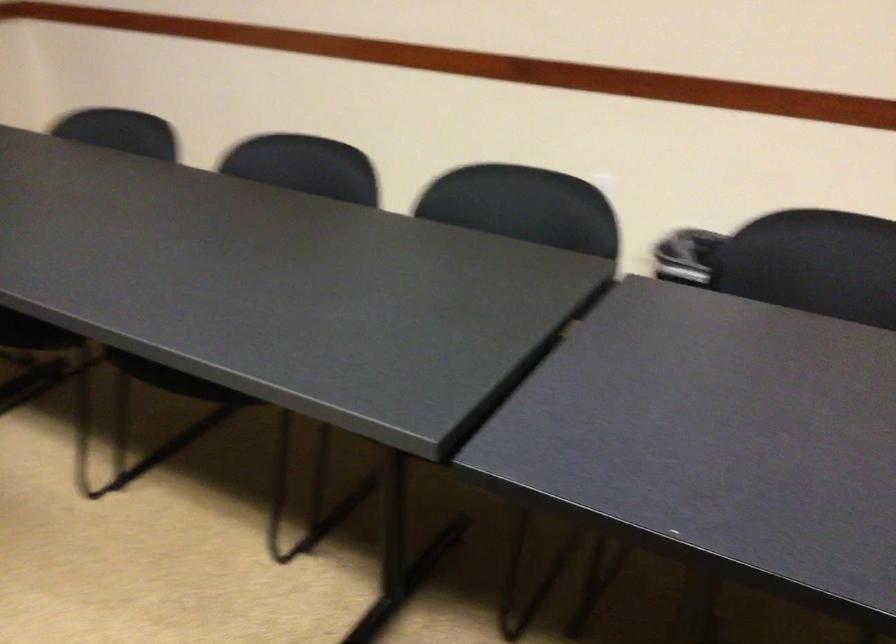
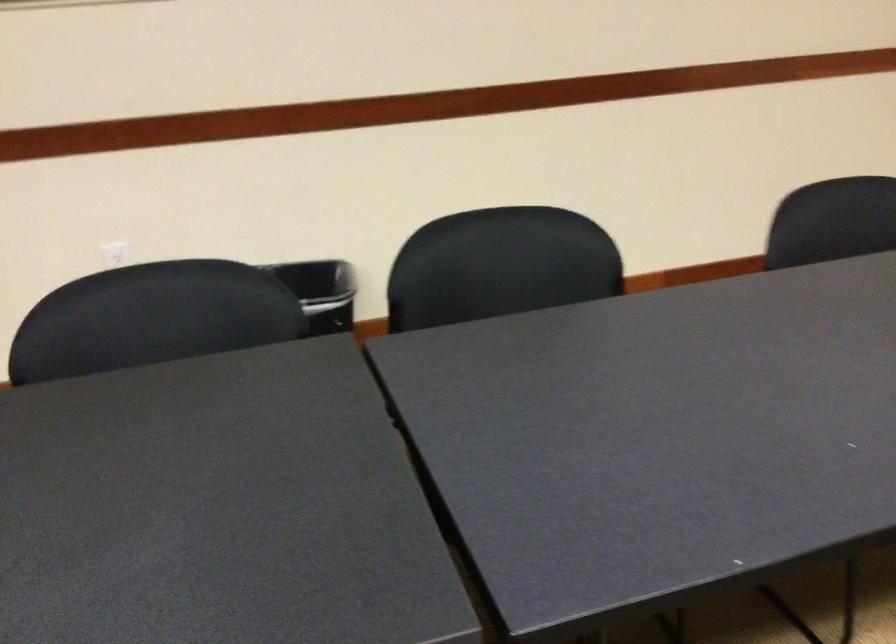
Question: The first image is from the beginning of the video and the second image is from the end. How did the camera likely rotate when shooting the video?

Choices:
 (A) Left
 (B) Right
 (C) Up
 (D) Down

Answer: (B)